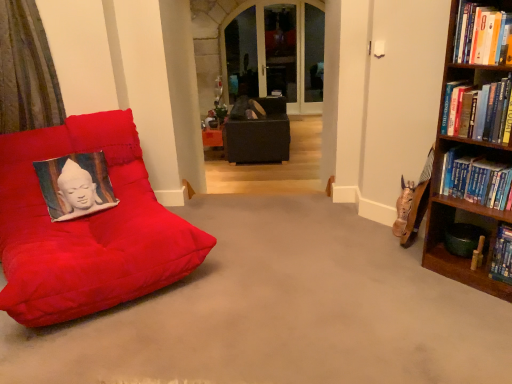
Question: Can you confirm if textured fabric pillow at left is shorter than hardcover book at upper right, the 2th book ordered from the bottom?

Choices:
 (A) no
 (B) yes

Answer: (B)

Question: Considering the relative sizes of textured fabric pillow at left and hardcover book at upper right, the 2th book ordered from the bottom, in the image provided, is textured fabric pillow at left wider than hardcover book at upper right, the 2th book ordered from the bottom,?

Choices:
 (A) yes
 (B) no

Answer: (B)

Question: From a real-world perspective, is textured fabric pillow at left positioned over hardcover book at upper right, arranged as the 2th book when viewed from the top, based on gravity?

Choices:
 (A) no
 (B) yes

Answer: (A)

Question: Can you see textured fabric pillow at left touching hardcover book at upper right, arranged as the 2th book when viewed from the top?

Choices:
 (A) no
 (B) yes

Answer: (A)

Question: Is hardcover book at upper right, arranged as the 2th book when viewed from the top, at the back of textured fabric pillow at left?

Choices:
 (A) no
 (B) yes

Answer: (A)

Question: Would you say matte black bean bag at center is inside or outside hardcover book at upper right, arranged as the 2th book when viewed from the top?

Choices:
 (A) outside
 (B) inside

Answer: (A)

Question: From their relative heights in the image, would you say matte black bean bag at center is taller or shorter than hardcover book at upper right, the 2th book ordered from the bottom?

Choices:
 (A) short
 (B) tall

Answer: (B)

Question: Is matte black bean bag at center in front of or behind hardcover book at upper right, arranged as the 2th book when viewed from the top, in the image?

Choices:
 (A) front
 (B) behind

Answer: (B)

Question: From a real-world perspective, is matte black bean bag at center above or below hardcover book at upper right, the 2th book ordered from the bottom?

Choices:
 (A) above
 (B) below

Answer: (B)

Question: Is textured fabric pillow at left taller or shorter than hardcover book at upper right, the 2th book ordered from the bottom?

Choices:
 (A) short
 (B) tall

Answer: (A)

Question: Looking at their shapes, would you say textured fabric pillow at left is wider or thinner than hardcover book at upper right, the 2th book ordered from the bottom?

Choices:
 (A) wide
 (B) thin

Answer: (B)

Question: Considering the positions of point (93, 206) and point (493, 127), is point (93, 206) closer or farther from the camera than point (493, 127)?

Choices:
 (A) farther
 (B) closer

Answer: (A)

Question: In the image, is textured fabric pillow at left on the left side or the right side of hardcover book at upper right, the 2th book ordered from the bottom?

Choices:
 (A) left
 (B) right

Answer: (A)

Question: Is suede red beanbag at left to the left or to the right of hardcover book at upper right, arranged as the first book when viewed from the top, in the image?

Choices:
 (A) right
 (B) left

Answer: (B)

Question: In terms of width, does suede red beanbag at left look wider or thinner when compared to hardcover book at upper right, acting as the 3th book starting from the bottom?

Choices:
 (A) thin
 (B) wide

Answer: (B)